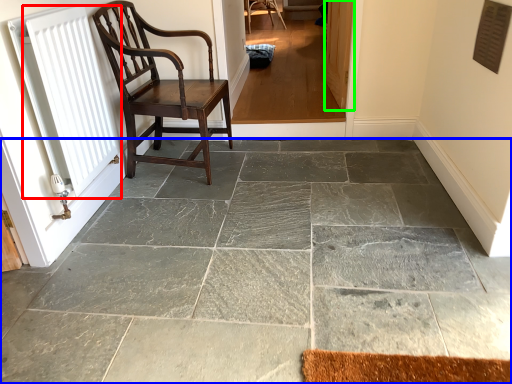
Question: Which is nearer to the radiator (highlighted by a red box)? concrete (highlighted by a blue box) or screen door (highlighted by a green box).

Choices:
 (A) concrete
 (B) screen door

Answer: (A)